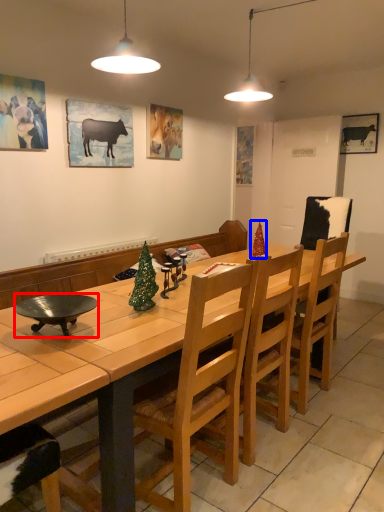
Question: Which object appears farthest to the camera in this image, bowl (highlighted by a red box) or christmas tree (highlighted by a blue box)?

Choices:
 (A) bowl
 (B) christmas tree

Answer: (B)